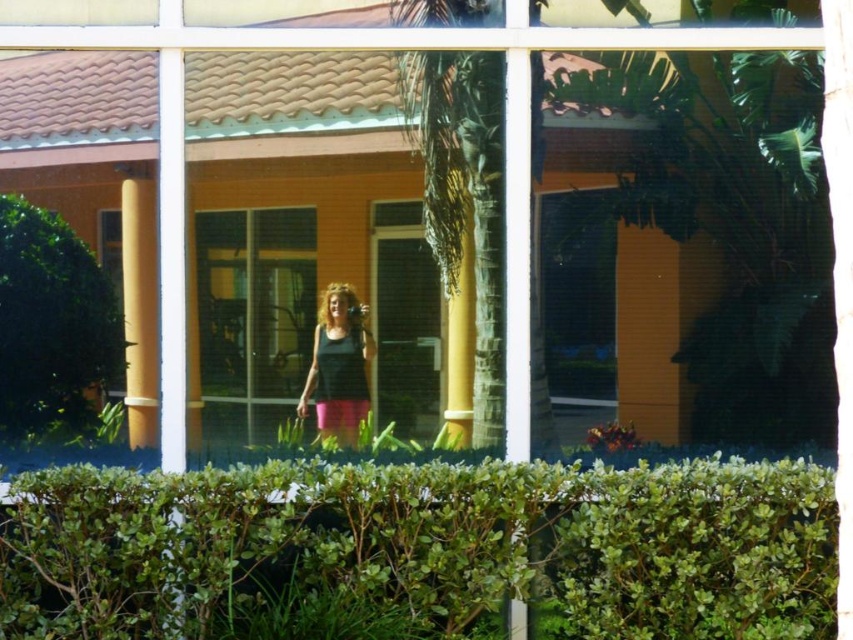
Question: Which of the following is the farthest from the observer?

Choices:
 (A) black matte tank top at center
 (B) green leafy hedge at lower center
 (C) yellow matte pillar at left
 (D) clear glass window at center

Answer: (A)

Question: Does green leafy hedge at lower center have a lesser width compared to clear glass window at center?

Choices:
 (A) no
 (B) yes

Answer: (A)

Question: Is clear glass window at center smaller than yellow matte pillar at left?

Choices:
 (A) yes
 (B) no

Answer: (B)

Question: Which object is farther from the camera taking this photo?

Choices:
 (A) yellow matte pillar at left
 (B) green leafy hedge at lower center

Answer: (A)

Question: Which object is farther from the camera taking this photo?

Choices:
 (A) black matte tank top at center
 (B) green leafy bush at left
 (C) clear glass window at center

Answer: (A)

Question: Does green leafy bush at left have a greater width compared to yellow matte pillar at left?

Choices:
 (A) no
 (B) yes

Answer: (B)